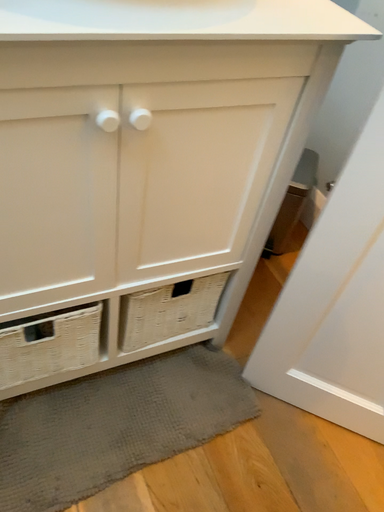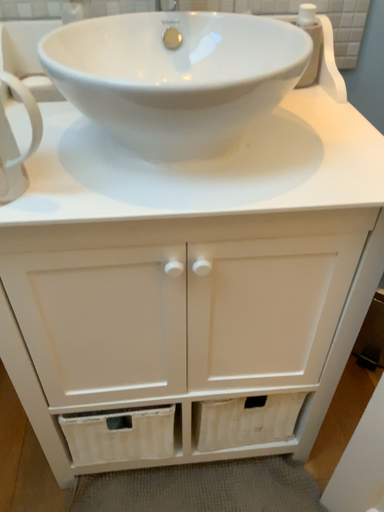
Question: Which way did the camera rotate in the video?

Choices:
 (A) rotated downward
 (B) rotated upward

Answer: (B)